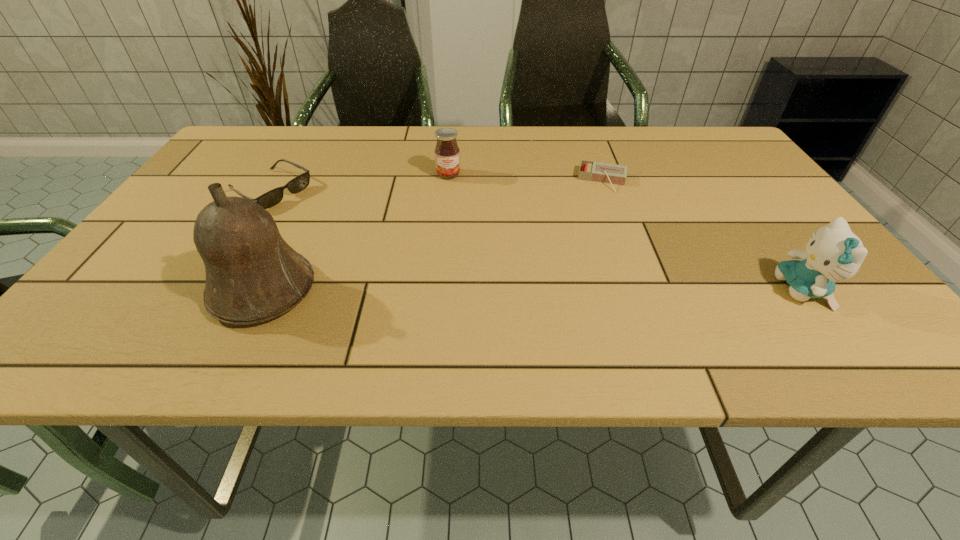
Find the location of a particular element. The image size is (960, 540). blank space located 0.350m on the face of the kitten is located at coordinates (598, 290).

You are a GUI agent. You are given a task and a screenshot of the screen. Output one action in this format:
    pyautogui.click(x=<x>, y=<y>)
    Task: Click on the vacant region located on the face of the kitten
    Image resolution: width=960 pixels, height=540 pixels.
    Given the screenshot: What is the action you would take?
    pyautogui.click(x=665, y=290)

The width and height of the screenshot is (960, 540). I want to click on free point located on the striking surface of the shortest object, so click(x=588, y=282).

The image size is (960, 540). In order to click on free region located 0.170m on the striking surface of the shortest object in this screenshot , I will do `click(595, 234)`.

Identify the location of vacant region located 0.390m on the striking surface of the shortest object. (586, 304).

Find the location of a particular element. This screenshot has height=540, width=960. free space located 0.370m on the label side of the jam is located at coordinates (467, 281).

Where is `free location located on the label side of the jam`? Image resolution: width=960 pixels, height=540 pixels. free location located on the label side of the jam is located at coordinates (456, 221).

Locate an element on the screen. Image resolution: width=960 pixels, height=540 pixels. free spot located on the label side of the jam is located at coordinates pos(453,201).

The width and height of the screenshot is (960, 540). I want to click on vacant space located 0.110m on the front-facing side of the second shortest object, so click(x=326, y=220).

I want to click on vacant area situated on the front-facing side of the second shortest object, so coord(341,227).